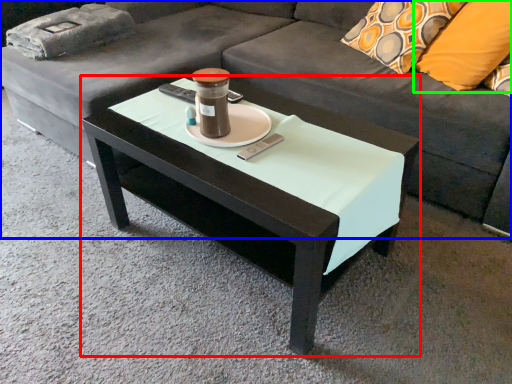
Question: Which object is the closest to the coffee table (highlighted by a red box)? Choose among these: studio couch (highlighted by a blue box) or pillow (highlighted by a green box).

Choices:
 (A) studio couch
 (B) pillow

Answer: (A)